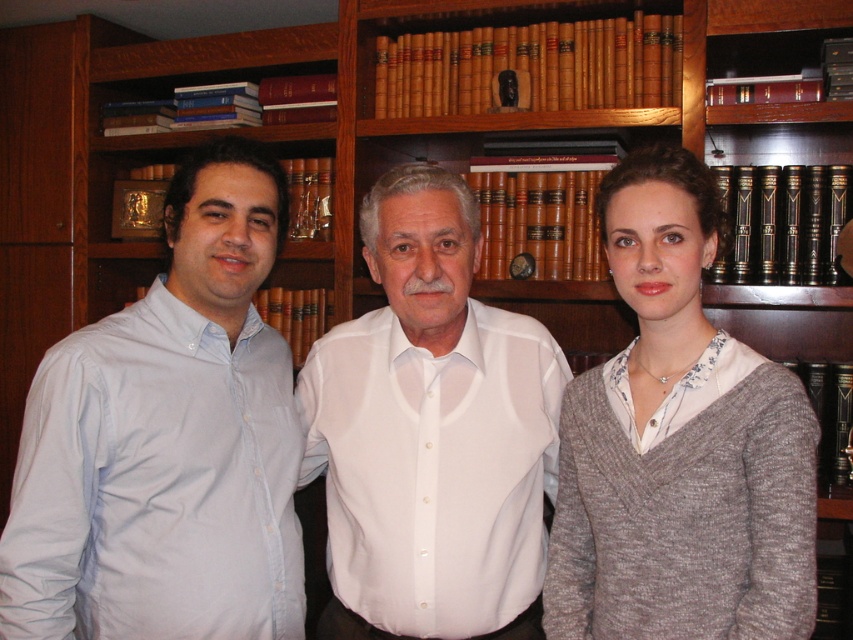
Looking at this image, you are a fashion designer observing the three people in the image. You need to determine which clothing item, the knit gray sweater at center or the white smooth shirt at center, would be more suitable for a tight fitting outfit. Based on their current appearance, which one would you choose?

The knit gray sweater at center is thinner than the white smooth shirt at center, so the knit gray sweater at center would be more suitable for a tight fitting outfit since it is thinner and can conform better to the body.

You are standing in front of the bookshelf and want to reach two points marked on the wall. The first point is at coordinate point (111, 346) and the second is at point (386, 616). Which point should you aim for first if you want to reach the one closer to you?

Point (111, 346) is closer to the viewer than point (386, 616), so you should aim for point (111, 346) first.

You are standing in front of the bookshelf and see two people wearing the light blue cotton shirt at left and the knit gray sweater at center. Which person is closer to your left side?

The light blue cotton shirt at left is to the left of the knit gray sweater at center, so the person in the light blue cotton shirt at left is closer to your left side.